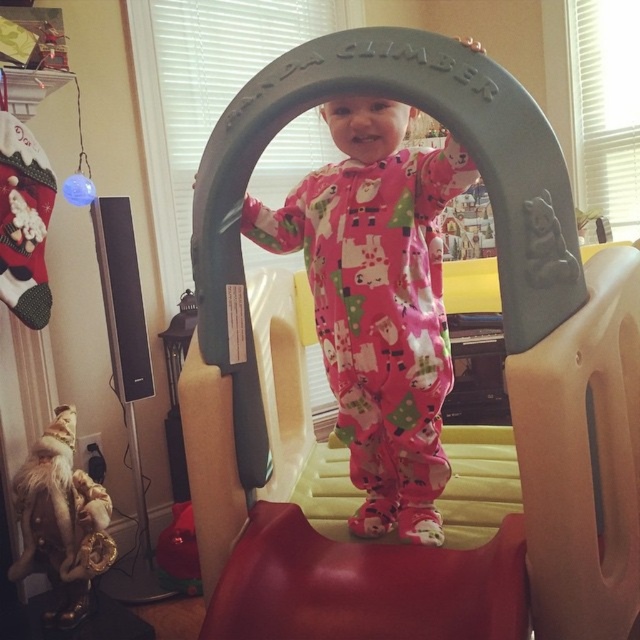
Question: Observing the image, what is the correct spatial positioning of plastic at center in reference to fuzzy fabric plush at lower left?

Choices:
 (A) above
 (B) below

Answer: (A)

Question: In this image, where is plastic at center located relative to fuzzy fabric plush at lower left?

Choices:
 (A) right
 (B) left

Answer: (A)

Question: Estimate the real-world distances between objects in this image. Which object is farther from the pink cotton onesie at center?

Choices:
 (A) fuzzy fabric plush at lower left
 (B) plastic at center

Answer: (A)

Question: Which object appears closest to the camera in this image?

Choices:
 (A) fuzzy fabric plush at lower left
 (B) pink cotton onesie at center

Answer: (B)

Question: Does plastic at center appear under pink cotton onesie at center?

Choices:
 (A) no
 (B) yes

Answer: (B)

Question: Which object is closer to the camera taking this photo?

Choices:
 (A) fuzzy fabric plush at lower left
 (B) plastic at center

Answer: (B)